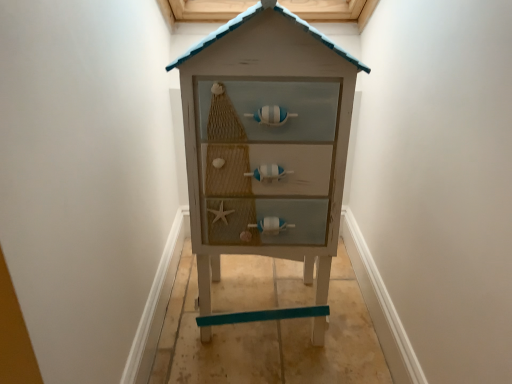
Question: Should I look upward or downward to see white wood chest of drawers at center?

Choices:
 (A) down
 (B) up

Answer: (B)